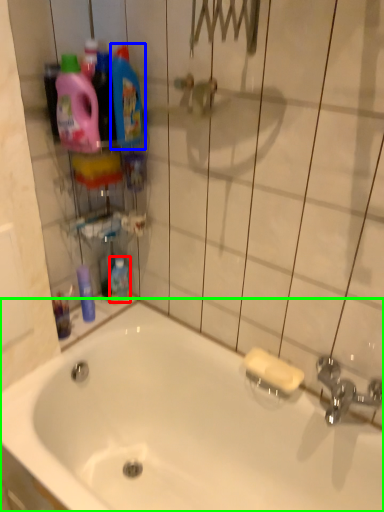
Question: Which is farther away from mouthwash (highlighted by a red box)? cleaning product (highlighted by a blue box) or bathtub (highlighted by a green box)?

Choices:
 (A) cleaning product
 (B) bathtub

Answer: (A)